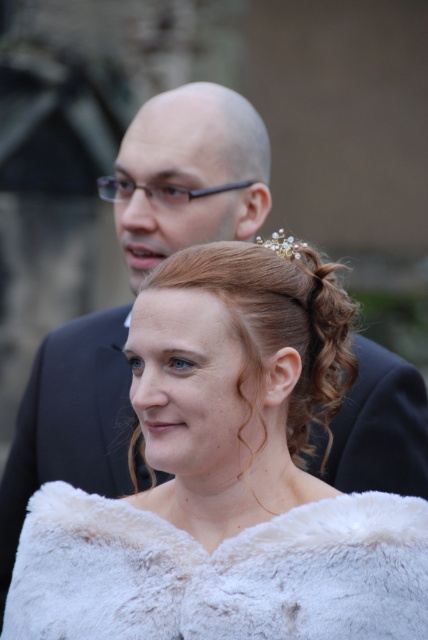
Based on the photo, you are standing in front of the two people in the image. Which point, point (175, 419) or point (305, 243), is closer to you?

Point (175, 419) is closer to you because it is in front of point (305, 243).

Based on the scene description, can you determine which object is closer to the camera between the white fur coat at center and the curly blonde hair at center?

The white fur coat at center is in front of curly blonde hair at center, so the white fur coat at center is closer to the camera.